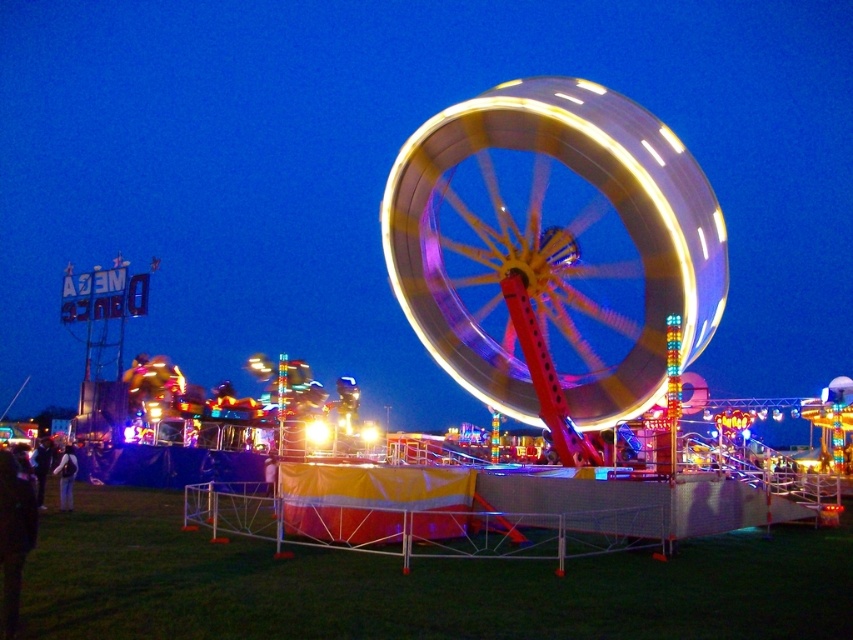
Question: Which object appears farthest from the camera in this image?

Choices:
 (A) metallic shiny roller coaster at center
 (B) dark blue shirt at lower left

Answer: (B)

Question: Can you confirm if light blue jeans at lower left is smaller than dark blue shirt at lower left?

Choices:
 (A) yes
 (B) no

Answer: (A)

Question: In this image, where is metallic shiny roller coaster at center located relative to light blue jeans at lower left?

Choices:
 (A) right
 (B) left

Answer: (A)

Question: Which of the following is the farthest from the observer?

Choices:
 (A) (41, 470)
 (B) (515, 129)
 (C) (64, 464)
 (D) (643, 620)

Answer: (A)

Question: Does metallic shiny roller coaster at center have a smaller size compared to dark blue shirt at lower left?

Choices:
 (A) no
 (B) yes

Answer: (B)

Question: Estimate the real-world distances between objects in this image. Which object is farther from the metallic shiny roller coaster at center?

Choices:
 (A) metallic yellow ferris wheel at center
 (B) dark blue shirt at lower left
 (C) light blue jeans at lower left

Answer: (C)